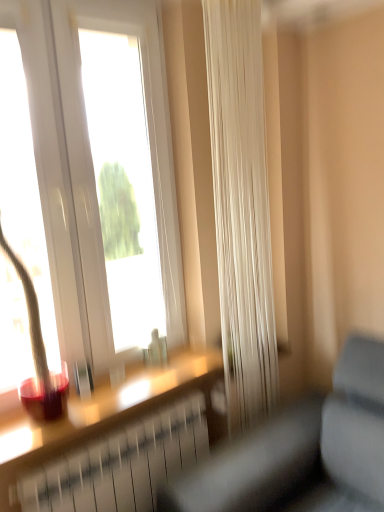
The image size is (384, 512). I want to click on matte glass window sill at lower left, so click(106, 408).

Identify the location of white sheer curtain at center. (241, 206).

Is matte glass window sill at lower left to the left of gray fabric couch at lower right from the viewer's perspective?

Correct, you'll find matte glass window sill at lower left to the left of gray fabric couch at lower right.

From a real-world perspective, between matte glass window sill at lower left and gray fabric couch at lower right, who is vertically higher?

matte glass window sill at lower left is physically above.

Consider the image. Can you confirm if matte glass window sill at lower left is taller than gray fabric couch at lower right?

No.

Is point (166, 369) closer to camera compared to point (345, 501)?

No, it is not.

Is white sheer curtain at center turned away from matte glass window sill at lower left?

No, white sheer curtain at center's orientation is not away from matte glass window sill at lower left.

Does white sheer curtain at center have a larger size compared to matte glass window sill at lower left?

Correct, white sheer curtain at center is larger in size than matte glass window sill at lower left.

The image size is (384, 512). Identify the location of window sill that is in front of the white sheer curtain at center. click(x=106, y=408).

Is white sheer curtain at center inside the boundaries of matte glass window sill at lower left, or outside?

white sheer curtain at center lies outside matte glass window sill at lower left.

Where is `curtain located on the left of gray fabric couch at lower right`? curtain located on the left of gray fabric couch at lower right is located at coordinates coord(241,206).

Between point (263, 334) and point (314, 418), which one is positioned in front?

The point (314, 418) is more forward.

Considering the sizes of objects white sheer curtain at center and gray fabric couch at lower right in the image provided, who is shorter, white sheer curtain at center or gray fabric couch at lower right?

gray fabric couch at lower right is shorter.

Which point is more forward, (x=108, y=403) or (x=256, y=221)?

The point (x=108, y=403) is more forward.

Is matte glass window sill at lower left bigger than white sheer curtain at center?

Incorrect, matte glass window sill at lower left is not larger than white sheer curtain at center.

Image resolution: width=384 pixels, height=512 pixels. In order to click on window sill that appears in front of the white sheer curtain at center in this screenshot , I will do (106, 408).

Is matte glass window sill at lower left further to the viewer compared to white sheer curtain at center?

No, it is in front of white sheer curtain at center.

Is point (306, 485) closer or farther from the camera than point (189, 367)?

Point (306, 485) is closer to the camera than point (189, 367).

Is gray fabric couch at lower right positioned with its back to matte glass window sill at lower left?

gray fabric couch at lower right does not have its back to matte glass window sill at lower left.

Who is taller, gray fabric couch at lower right or white sheer curtain at center?

Standing taller between the two is white sheer curtain at center.

Is gray fabric couch at lower right not close to white sheer curtain at center?

No, gray fabric couch at lower right is not far from white sheer curtain at center.

From the image's perspective, which one is positioned lower, gray fabric couch at lower right or white sheer curtain at center?

gray fabric couch at lower right appears lower in the image.

Consider the image. Can you confirm if gray fabric couch at lower right is positioned to the left of white sheer curtain at center?

Incorrect, gray fabric couch at lower right is not on the left side of white sheer curtain at center.

Locate an element on the screen. The height and width of the screenshot is (512, 384). studio couch that appears below the matte glass window sill at lower left (from the image's perspective) is located at coordinates (301, 450).

The image size is (384, 512). In order to click on curtain that appears above the matte glass window sill at lower left (from the image's perspective) in this screenshot , I will do `click(241, 206)`.

Based on their spatial positions, is matte glass window sill at lower left or white sheer curtain at center closer to gray fabric couch at lower right?

matte glass window sill at lower left is positioned closer to the anchor gray fabric couch at lower right.

Which object lies further to the anchor point matte glass window sill at lower left, white sheer curtain at center or gray fabric couch at lower right?

white sheer curtain at center lies further to matte glass window sill at lower left than the other object.

Based on their spatial positions, is white sheer curtain at center or matte glass window sill at lower left closer to gray fabric couch at lower right?

Based on the image, matte glass window sill at lower left appears to be nearer to gray fabric couch at lower right.

From the image, which object appears to be nearer to white sheer curtain at center, gray fabric couch at lower right or matte glass window sill at lower left?

gray fabric couch at lower right is closer to white sheer curtain at center.

From the image, which object appears to be nearer to white sheer curtain at center, matte glass window sill at lower left or gray fabric couch at lower right?

Among the two, gray fabric couch at lower right is located nearer to white sheer curtain at center.

Looking at the image, which one is located further to matte glass window sill at lower left, gray fabric couch at lower right or white sheer curtain at center?

white sheer curtain at center.

At what (x,y) coordinates should I click in order to perform the action: click on window sill between gray fabric couch at lower right and white sheer curtain at center from front to back. Please return your answer as a coordinate pair (x, y). Looking at the image, I should click on (106, 408).